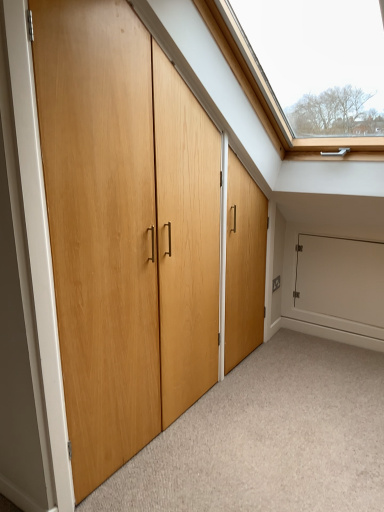
You are a GUI agent. You are given a task and a screenshot of the screen. Output one action in this format:
    pyautogui.click(x=<x>, y=<y>)
    Task: Click on the vacant space in front of natural wood door at center
    The image size is (384, 512).
    Given the screenshot: What is the action you would take?
    pyautogui.click(x=215, y=455)